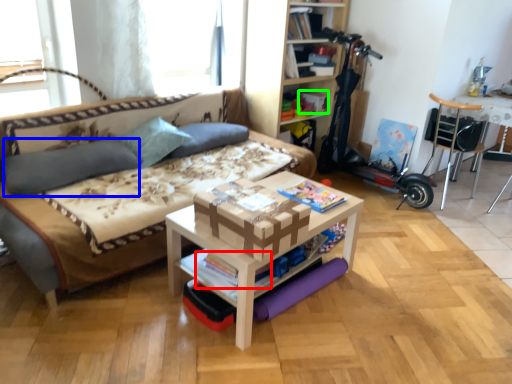
Question: Which is farther away from magazine (highlighted by a red box)? pillow (highlighted by a blue box) or storage box (highlighted by a green box)?

Choices:
 (A) pillow
 (B) storage box

Answer: (B)